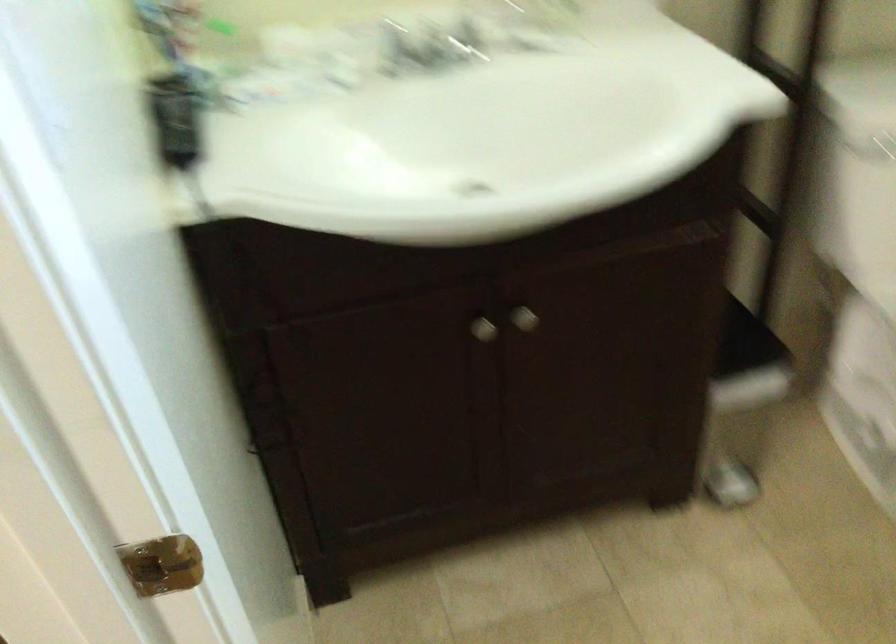
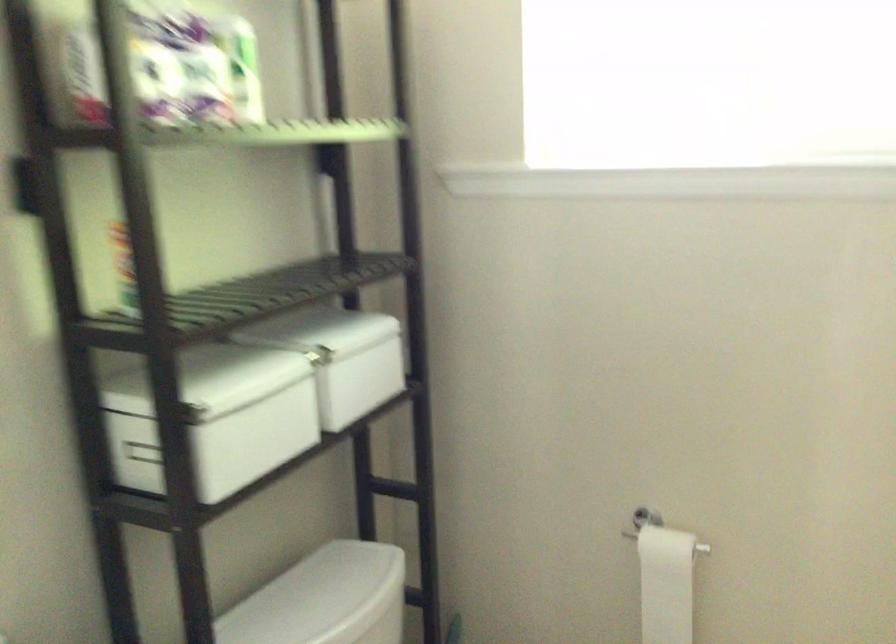
Consider the image. First-person continuous shooting, in which direction is the camera rotating?

The camera rotated toward right-up.